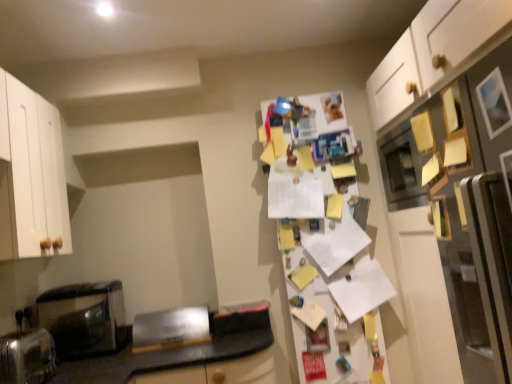
Question: Is white paper covered fridge at center, acting as the second fridge starting from the front, taller or shorter than satin silver toaster at lower left, placed as the first appliance when sorted from front to back?

Choices:
 (A) short
 (B) tall

Answer: (B)

Question: In the image, is white paper covered fridge at center, acting as the second fridge starting from the front, on the left side or the right side of satin silver toaster at lower left, marked as the 2th appliance in a right-to-left arrangement?

Choices:
 (A) right
 (B) left

Answer: (A)

Question: Estimate the real-world distances between objects in this image. Which object is farther from the white matte refrigerator at right, the second fridge when ordered from back to front?

Choices:
 (A) brushed metal toaster at lower left, the 2th appliance viewed from the left
 (B) satin silver toaster at lower left, marked as the 2th appliance in a right-to-left arrangement
 (C) black glossy microwave at left
 (D) white paper covered fridge at center, the 2th fridge from the right

Answer: (C)

Question: Estimate the real-world distances between objects in this image. Which object is farther from the white paper covered fridge at center, acting as the second fridge starting from the front?

Choices:
 (A) black glossy microwave at left
 (B) white matte refrigerator at right, the second fridge in the left-to-right sequence
 (C) satin silver toaster at lower left, the first appliance viewed from the left
 (D) brushed metal toaster at lower left, the 2th appliance viewed from the left

Answer: (C)